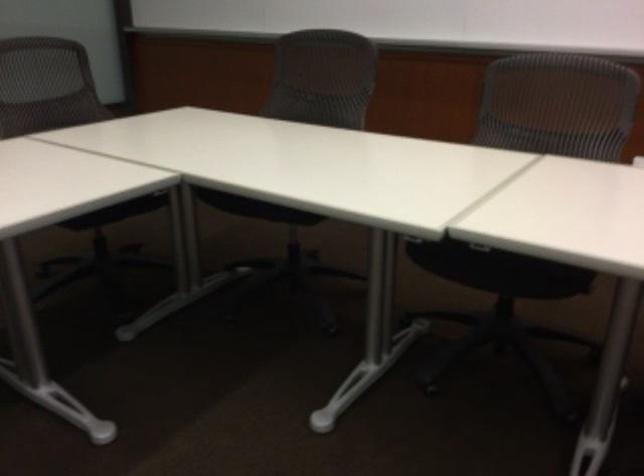
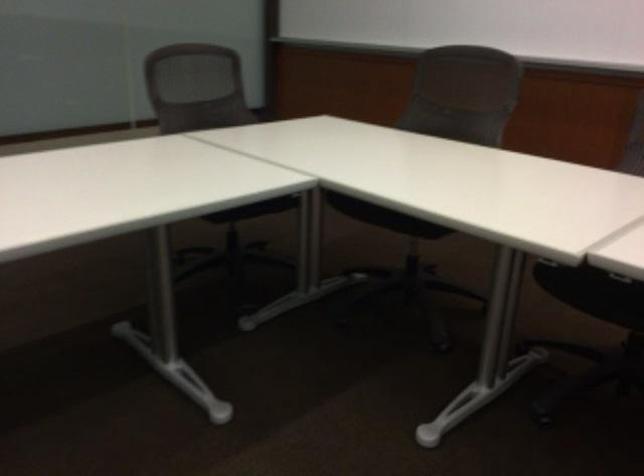
Question: How did the camera likely rotate?

Choices:
 (A) Left
 (B) Right
 (C) Up
 (D) Down

Answer: (A)